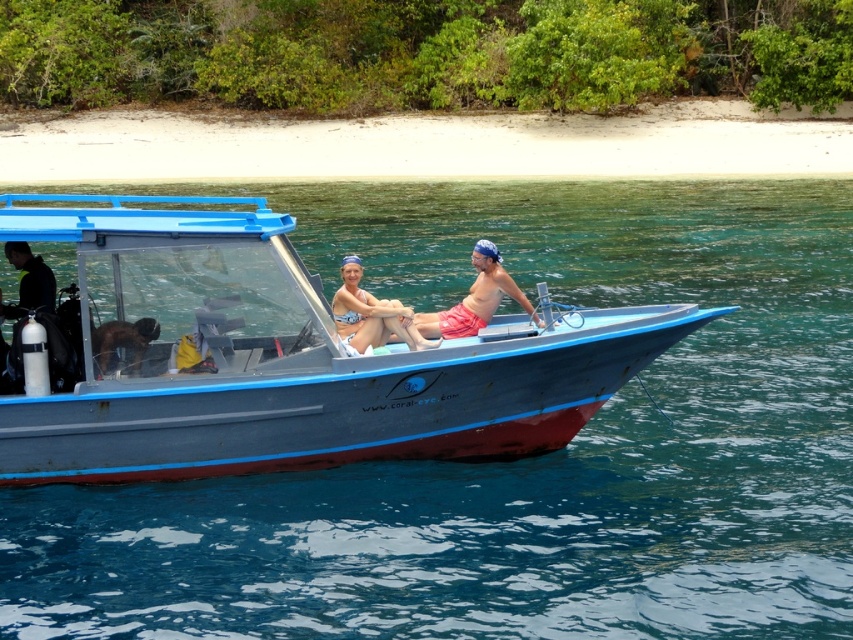
Is point (509, 417) closer to camera compared to point (373, 301)?

Yes.

What do you see at coordinates (279, 356) in the screenshot? Image resolution: width=853 pixels, height=640 pixels. I see `blue metallic boat at center` at bounding box center [279, 356].

At what (x,y) coordinates should I click in order to perform the action: click on blue metallic boat at center. Please return your answer as a coordinate pair (x, y). Looking at the image, I should click on (279, 356).

The width and height of the screenshot is (853, 640). I want to click on blue metallic boat at center, so click(x=279, y=356).

Is matte orange shorts at center to the left of matte pink bikini at center from the viewer's perspective?

No, matte orange shorts at center is not to the left of matte pink bikini at center.

Which is below, matte orange shorts at center or matte pink bikini at center?

Positioned lower is matte pink bikini at center.

Who is more forward, (474, 321) or (396, 314)?

Point (396, 314) is in front.

Locate an element on the screen. The height and width of the screenshot is (640, 853). matte orange shorts at center is located at coordinates (440, 310).

Does blue metallic boat at center appear under matte pink bikini at center?

No.

Can you confirm if blue metallic boat at center is positioned to the left of matte pink bikini at center?

Correct, you'll find blue metallic boat at center to the left of matte pink bikini at center.

Who is more forward, (x=367, y=403) or (x=370, y=305)?

Point (x=367, y=403)

The image size is (853, 640). Find the location of `blue metallic boat at center`. blue metallic boat at center is located at coordinates tap(279, 356).